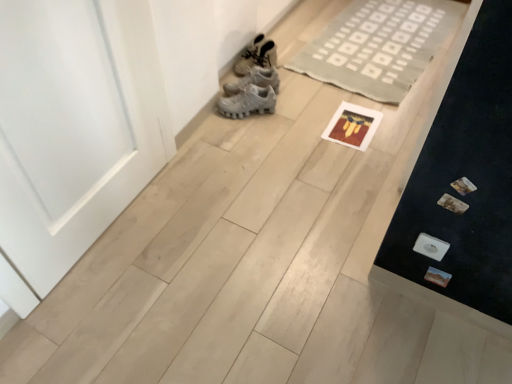
Question: From the image's perspective, relative to white matte door at left, is neutral woven rug at upper center above or below?

Choices:
 (A) below
 (B) above

Answer: (B)

Question: Considering the positions of point (333, 18) and point (109, 158), is point (333, 18) closer or farther from the camera than point (109, 158)?

Choices:
 (A) farther
 (B) closer

Answer: (A)

Question: Which object is the closest to the neutral woven rug at upper center?

Choices:
 (A) white matte door at left
 (B) white matte sneakers at upper center

Answer: (B)

Question: Which object is the closest to the white matte door at left?

Choices:
 (A) white matte sneakers at upper center
 (B) neutral woven rug at upper center

Answer: (A)